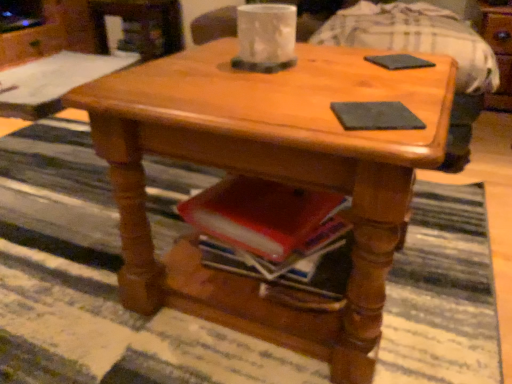
Where is `vacant area situated to the left side of black matte pad at center, which is the first pad from front to back`? The width and height of the screenshot is (512, 384). vacant area situated to the left side of black matte pad at center, which is the first pad from front to back is located at coordinates [271, 108].